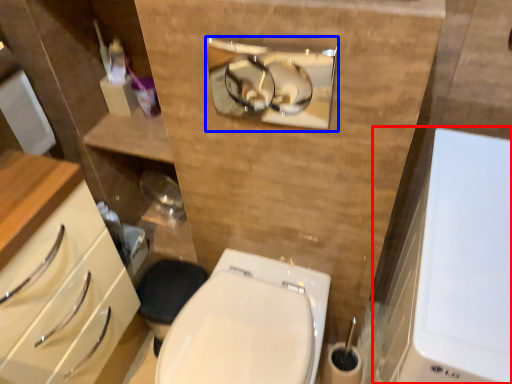
Question: Among these objects, which one is nearest to the camera, medicine cabinet (highlighted by a red box) or medicine cabinet (highlighted by a blue box)?

Choices:
 (A) medicine cabinet
 (B) medicine cabinet

Answer: (A)